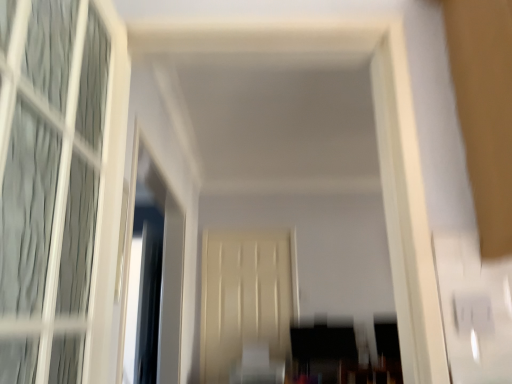
What are the coordinates of `beige matte door at center` in the screenshot? It's located at (245, 297).

The width and height of the screenshot is (512, 384). Describe the element at coordinates (245, 297) in the screenshot. I see `beige matte door at center` at that location.

Describe the element at coordinates (152, 275) in the screenshot. This screenshot has width=512, height=384. I see `clear glass window screen at left` at that location.

You are a GUI agent. You are given a task and a screenshot of the screen. Output one action in this format:
    pyautogui.click(x=<x>, y=<y>)
    Task: Click on the clear glass window screen at left
    The height and width of the screenshot is (384, 512).
    Given the screenshot: What is the action you would take?
    pyautogui.click(x=152, y=275)

You are a GUI agent. You are given a task and a screenshot of the screen. Output one action in this format:
    pyautogui.click(x=<x>, y=<y>)
    Task: Click on the beige matte door at center
    This screenshot has height=384, width=512.
    Given the screenshot: What is the action you would take?
    pyautogui.click(x=245, y=297)

Considering the relative positions of beige matte door at center and clear glass window screen at left in the image provided, is beige matte door at center to the left or to the right of clear glass window screen at left?

Clearly, beige matte door at center is on the right of clear glass window screen at left in the image.

Is the depth of beige matte door at center less than that of clear glass window screen at left?

No, it is not.

Which is in front, point (241, 252) or point (173, 377)?

The point (173, 377) is more forward.

From the image's perspective, who appears lower, beige matte door at center or clear glass window screen at left?

From the image's view, beige matte door at center is below.

From a real-world perspective, is beige matte door at center on top of clear glass window screen at left?

No, from a real-world perspective, beige matte door at center is not on top of clear glass window screen at left.

Can you confirm if beige matte door at center is wider than clear glass window screen at left?

No, beige matte door at center is not wider than clear glass window screen at left.

Which of these two, beige matte door at center or clear glass window screen at left, stands taller?

beige matte door at center.

Based on their sizes in the image, would you say beige matte door at center is bigger or smaller than clear glass window screen at left?

Clearly, beige matte door at center is smaller in size than clear glass window screen at left.

Is beige matte door at center situated inside clear glass window screen at left or outside?

beige matte door at center is located beyond the bounds of clear glass window screen at left.

Is beige matte door at center far from clear glass window screen at left?

beige matte door at center is actually quite close to clear glass window screen at left.

Is beige matte door at center turned away from clear glass window screen at left?

beige matte door at center is not turned away from clear glass window screen at left.

Can you tell me how much beige matte door at center and clear glass window screen at left differ in facing direction?

beige matte door at center and clear glass window screen at left are facing 179 degrees away from each other.

In the scene shown: Measure the distance between beige matte door at center and clear glass window screen at left.

They are 37.25 inches apart.

Image resolution: width=512 pixels, height=384 pixels. Find the location of `window screen that appears in front of the beige matte door at center`. window screen that appears in front of the beige matte door at center is located at coordinates (152, 275).

Considering the relative positions of clear glass window screen at left and beige matte door at center in the image provided, is clear glass window screen at left to the right of beige matte door at center from the viewer's perspective?

No.

Looking at this image, which object is closer to the camera taking this photo, clear glass window screen at left or beige matte door at center?

clear glass window screen at left is more forward.

Considering the points (135, 145) and (261, 329), which point is behind, point (135, 145) or point (261, 329)?

The point (261, 329) is farther.

From the image's perspective, is clear glass window screen at left above beige matte door at center?

Correct, clear glass window screen at left appears higher than beige matte door at center in the image.

From a real-world perspective, which object stands above the other?

clear glass window screen at left is physically above.

Which object is thinner, clear glass window screen at left or beige matte door at center?

With smaller width is beige matte door at center.

Is clear glass window screen at left taller than beige matte door at center?

No.

Is clear glass window screen at left bigger or smaller than beige matte door at center?

Clearly, clear glass window screen at left is larger in size than beige matte door at center.

Is clear glass window screen at left located outside beige matte door at center?

Indeed, clear glass window screen at left is completely outside beige matte door at center.

Is clear glass window screen at left not near beige matte door at center?

clear glass window screen at left is near beige matte door at center, not far away.

Is clear glass window screen at left turned away from beige matte door at center?

No, clear glass window screen at left is not facing the opposite direction of beige matte door at center.

How different are the orientations of clear glass window screen at left and beige matte door at center in degrees?

The facing directions of clear glass window screen at left and beige matte door at center are 179 degrees apart.

Locate an element on the screen. This screenshot has height=384, width=512. screen door behind the clear glass window screen at left is located at coordinates (245, 297).

You are a GUI agent. You are given a task and a screenshot of the screen. Output one action in this format:
    pyautogui.click(x=<x>, y=<y>)
    Task: Click on the window screen on the left of beige matte door at center
    Image resolution: width=512 pixels, height=384 pixels.
    Given the screenshot: What is the action you would take?
    pyautogui.click(x=152, y=275)

Locate an element on the screen. Image resolution: width=512 pixels, height=384 pixels. window screen lying in front of the beige matte door at center is located at coordinates (152, 275).